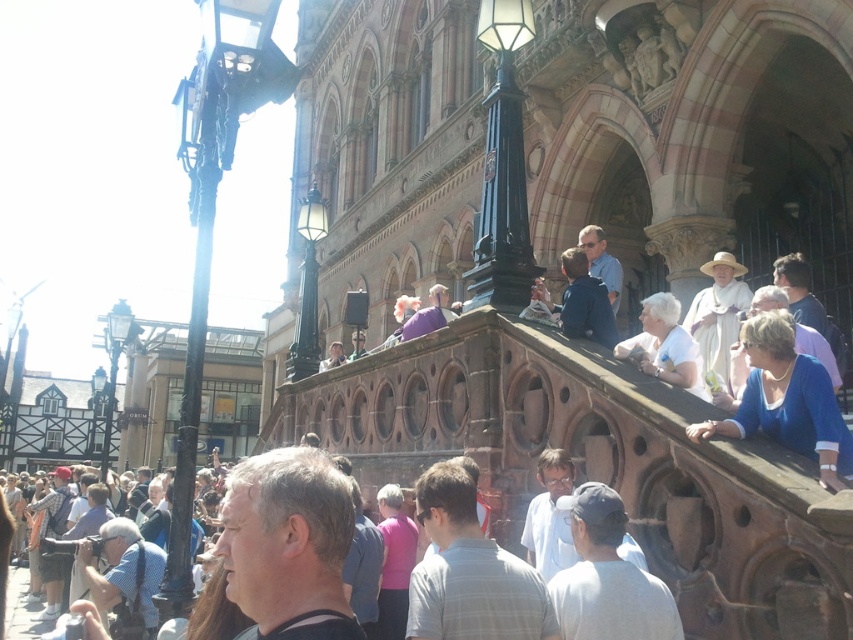
In the scene shown: You are standing at the entrance of the historic building and notice two points marked on the ground. The first point is at coordinate point (646, 332), and the second is at point (585, 253). If you want to walk towards the building, which point should you step on first?

Point (646, 332) is in front of point (585, 253), so you should step on point (646, 332) first to move towards the building.

You are a photographer trying to capture the entire scene of the historic building. You notice two people in the foreground wearing a white matte shirt at upper right and a dark blue shirt at upper center. Which person might be easier to include in your photo without cropping, considering their size in the frame?

The white matte shirt at upper right occupies less space than the dark blue shirt at upper center, so the person in the white matte shirt at upper right would be easier to include in the photo without cropping due to their smaller size in the frame.